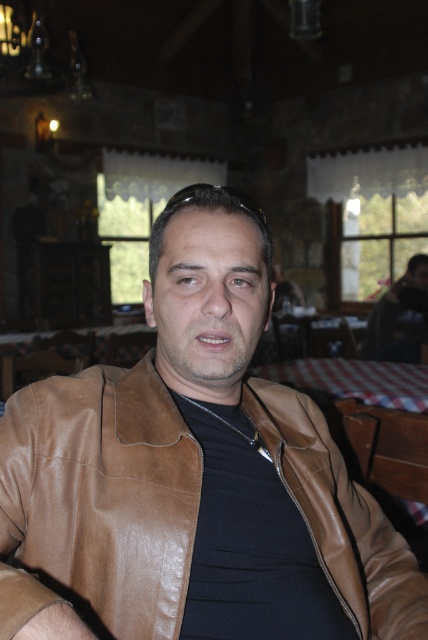
Question: Does brown leather jacket at center appear under dark green shirt at right?

Choices:
 (A) yes
 (B) no

Answer: (A)

Question: Which point appears closest to the camera in this image?

Choices:
 (A) (51, 592)
 (B) (410, 321)

Answer: (A)

Question: Where is brown leather jacket at center located in relation to dark green shirt at right in the image?

Choices:
 (A) left
 (B) right

Answer: (A)

Question: Which of the following is the closest to the observer?

Choices:
 (A) dark green shirt at right
 (B) brown leather jacket at center

Answer: (B)

Question: Does brown leather jacket at center appear under dark green shirt at right?

Choices:
 (A) no
 (B) yes

Answer: (B)